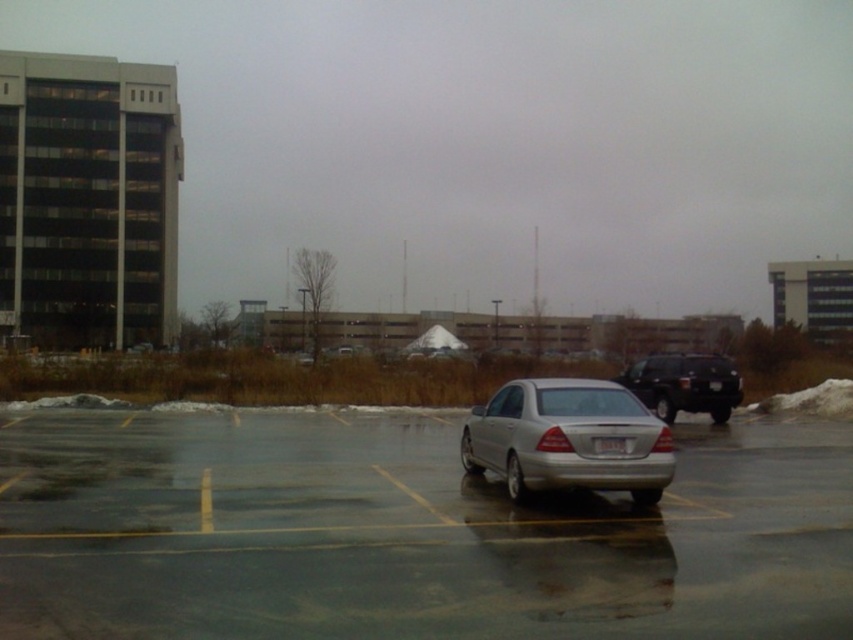
Who is positioned more to the right, silver metallic car at center or shiny black suv at right?

Positioned to the right is shiny black suv at right.

Can you confirm if silver metallic car at center is shorter than shiny black suv at right?

Indeed, silver metallic car at center has a lesser height compared to shiny black suv at right.

The height and width of the screenshot is (640, 853). What do you see at coordinates (405, 534) in the screenshot?
I see `silver metallic car at center` at bounding box center [405, 534].

This screenshot has width=853, height=640. Identify the location of silver metallic car at center. coord(405,534).

Is shiny black suv at right wider than white plastic license plate at center?

Yes, shiny black suv at right is wider than white plastic license plate at center.

Locate an element on the screen. This screenshot has width=853, height=640. shiny black suv at right is located at coordinates (683, 385).

Who is more forward, (693, 397) or (601, 445)?

Point (601, 445) is in front.

Where is `shiny black suv at right`? shiny black suv at right is located at coordinates pyautogui.click(x=683, y=385).

Is silver metallic sedan at center behind shiny black suv at right?

That is False.

Is silver metallic sedan at center smaller than shiny black suv at right?

Indeed, silver metallic sedan at center has a smaller size compared to shiny black suv at right.

Image resolution: width=853 pixels, height=640 pixels. Identify the location of silver metallic sedan at center. (567, 438).

Locate an element on the screen. This screenshot has height=640, width=853. silver metallic sedan at center is located at coordinates (567, 438).